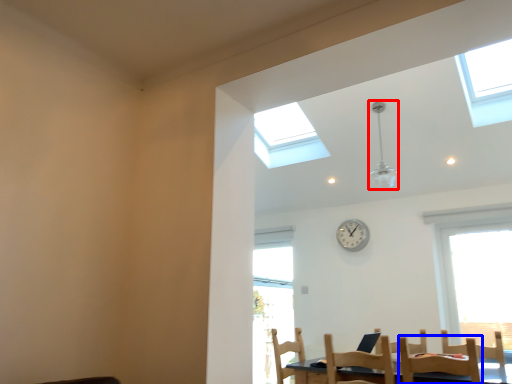
Question: Among these objects, which one is nearest to the camera, light fixture (highlighted by a red box) or chair (highlighted by a blue box)?

Choices:
 (A) light fixture
 (B) chair

Answer: (B)